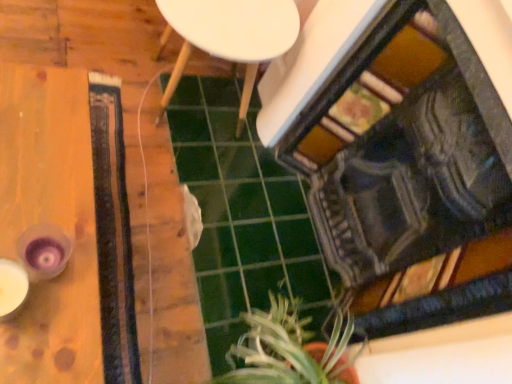
Question: Considering the relative sizes of green leafy plant at lower center and white matte side table at center in the image provided, is green leafy plant at lower center taller than white matte side table at center?

Choices:
 (A) yes
 (B) no

Answer: (B)

Question: Is white matte side table at center at the back of green leafy plant at lower center?

Choices:
 (A) no
 (B) yes

Answer: (A)

Question: Is green leafy plant at lower center smaller than white matte side table at center?

Choices:
 (A) yes
 (B) no

Answer: (A)

Question: Considering the relative sizes of green leafy plant at lower center and white matte side table at center in the image provided, is green leafy plant at lower center thinner than white matte side table at center?

Choices:
 (A) yes
 (B) no

Answer: (A)

Question: Is green leafy plant at lower center outside white matte side table at center?

Choices:
 (A) yes
 (B) no

Answer: (A)

Question: Is green leafy plant at lower center inside the boundaries of wooden table at left, or outside?

Choices:
 (A) inside
 (B) outside

Answer: (B)

Question: Is green leafy plant at lower center taller or shorter than wooden table at left?

Choices:
 (A) short
 (B) tall

Answer: (B)

Question: From the image's perspective, is green leafy plant at lower center located above or below wooden table at left?

Choices:
 (A) above
 (B) below

Answer: (B)

Question: From a real-world perspective, is green leafy plant at lower center physically located above or below wooden table at left?

Choices:
 (A) below
 (B) above

Answer: (B)

Question: Is wooden table at left taller or shorter than white matte side table at center?

Choices:
 (A) short
 (B) tall

Answer: (A)

Question: Is wooden table at left in front of or behind white matte side table at center in the image?

Choices:
 (A) behind
 (B) front

Answer: (B)

Question: From the image's perspective, is wooden table at left positioned above or below white matte side table at center?

Choices:
 (A) below
 (B) above

Answer: (A)

Question: Is point (25, 372) positioned closer to the camera than point (287, 28)?

Choices:
 (A) farther
 (B) closer

Answer: (B)

Question: Does point (179, 3) appear closer or farther from the camera than point (60, 153)?

Choices:
 (A) farther
 (B) closer

Answer: (A)

Question: From a real-world perspective, is white matte side table at center above or below wooden table at left?

Choices:
 (A) below
 (B) above

Answer: (B)